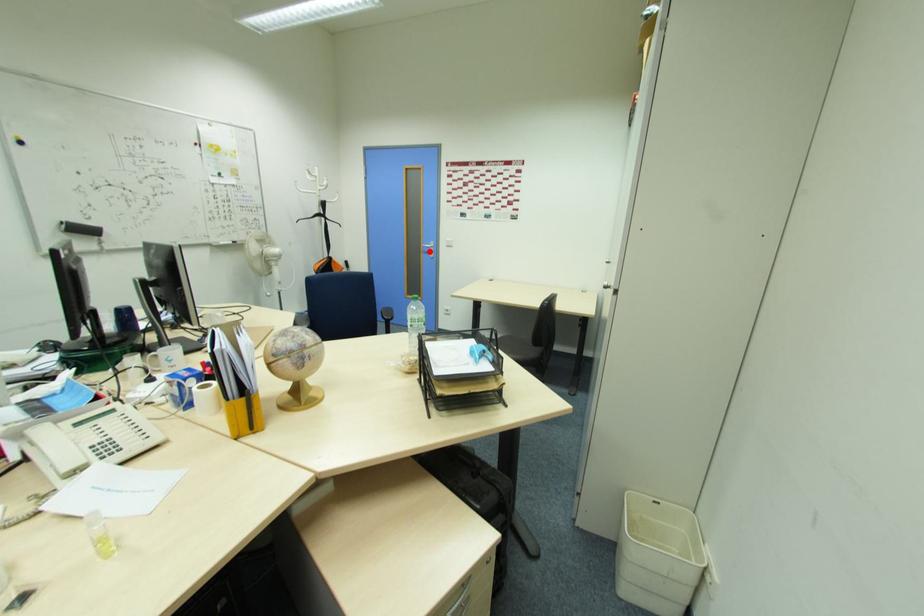
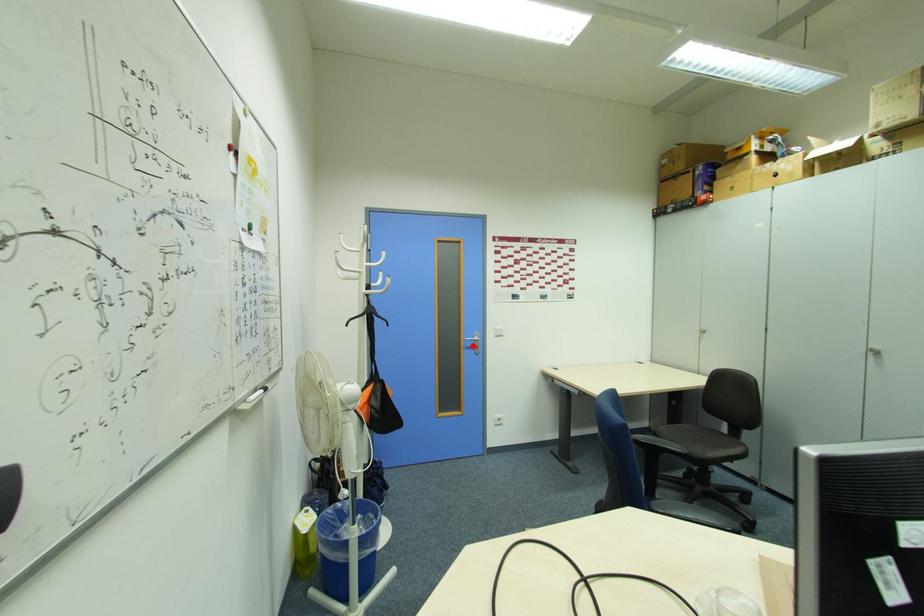
I am providing you with two images of the same scene from different viewpoints. A red point is marked on the first image and another point is marked on the second image. Is the marked point in image1 the same physical position as the marked point in image2?

Yes